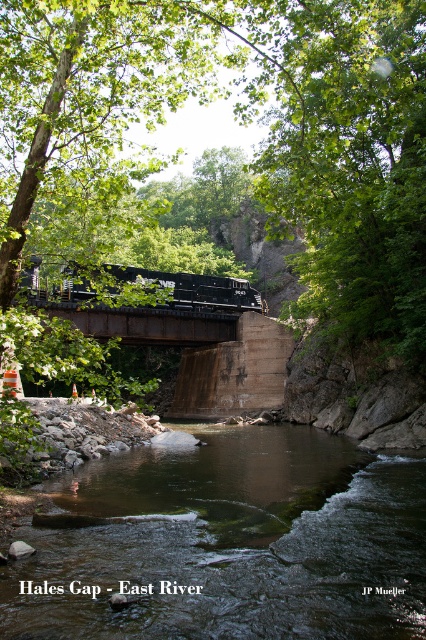
You are standing at the edge of the river at Hales Gap East River and see the point marked at coordinates [230,545]. Based on the scene description, what feature is located at that point?

The point at [230,545] indicates clear water at center.

You are a photographer planning to capture a landscape photo of the Hales Gap East River scene. You want to include both the green leafy tree at upper center and the black metal train at center in your shot. Based on their sizes, which object should you focus on to ensure both are clearly visible in the frame?

The green leafy tree at upper center is larger in size than the black metal train at center, so focusing on the larger tree would allow both objects to be clearly visible in the frame without cropping either.

You are a photographer planning to capture the clear water at center and the black metal train at center in a single frame. Based on their widths, which object should you position closer to the center of the frame to ensure both are fully visible?

Since the clear water at center is narrower than the black metal train at center, you should position the black metal train at center closer to the center of the frame to accommodate its larger width.